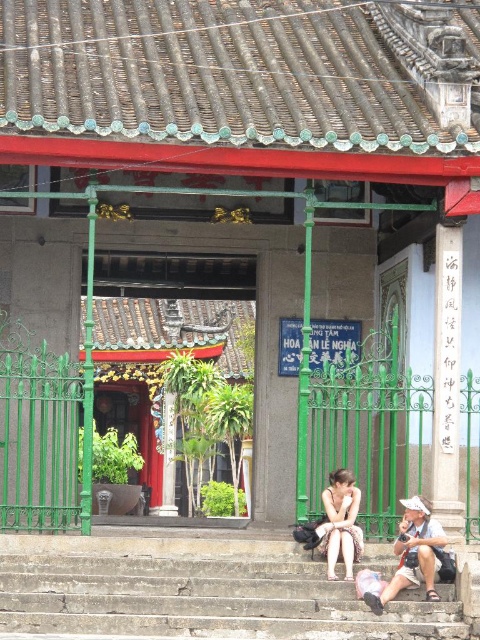
Does concrete stairs at lower center have a smaller size compared to matte white dress at center?

Yes, concrete stairs at lower center is smaller than matte white dress at center.

Measure the distance between concrete stairs at lower center and matte white dress at center.

concrete stairs at lower center is 10.48 feet from matte white dress at center.

What do you see at coordinates (197, 592) in the screenshot? I see `concrete stairs at lower center` at bounding box center [197, 592].

At what (x,y) coordinates should I click in order to perform the action: click on concrete stairs at lower center. Please return your answer as a coordinate pair (x, y). The image size is (480, 640). Looking at the image, I should click on (197, 592).

Which is below, concrete stairs at lower center or matte white shirt at lower center?

concrete stairs at lower center is below.

Measure the distance between concrete stairs at lower center and matte white shirt at lower center.

The distance of concrete stairs at lower center from matte white shirt at lower center is 10.54 feet.

Who is more forward, (235, 625) or (406, 577)?

Point (235, 625) is in front.

Identify the location of concrete stairs at lower center. (197, 592).

Which is below, matte white dress at center or matte white shirt at lower center?

matte white shirt at lower center is lower down.

Which of these two, matte white dress at center or matte white shirt at lower center, stands taller?

With more height is matte white shirt at lower center.

This screenshot has height=640, width=480. What do you see at coordinates (412, 557) in the screenshot?
I see `matte white dress at center` at bounding box center [412, 557].

Locate an element on the screen. matte white dress at center is located at coordinates (412, 557).